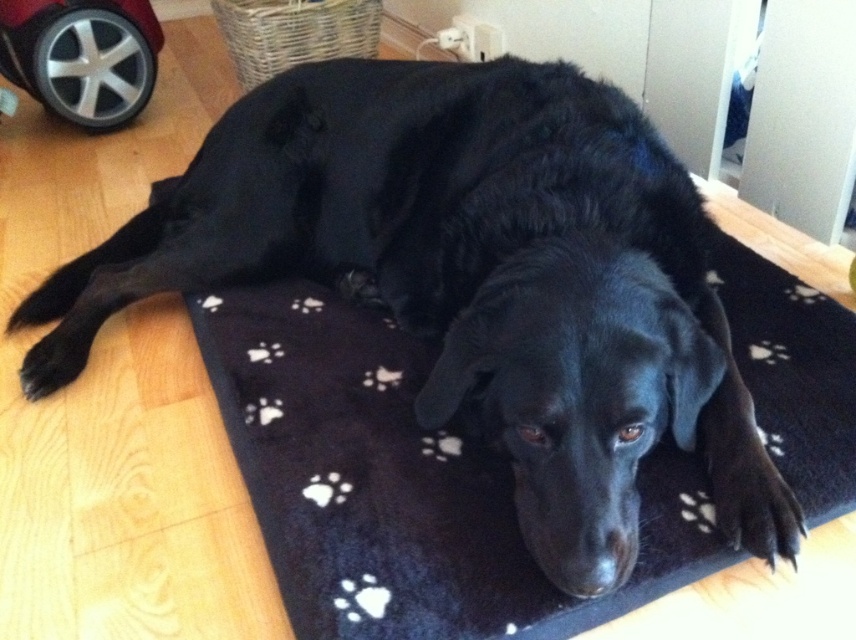
Looking at this image, can you confirm if black fuzzy paw at lower right is positioned to the right of black fur paw at lower left?

Yes, black fuzzy paw at lower right is to the right of black fur paw at lower left.

Who is lower down, black fuzzy paw at lower right or black fur paw at lower left?

Positioned lower is black fuzzy paw at lower right.

Image resolution: width=856 pixels, height=640 pixels. Find the location of `black fuzzy paw at lower right`. black fuzzy paw at lower right is located at coordinates (753, 500).

Can you confirm if black fleece dog bed at center is smaller than black fur paw at lower left?

No, black fleece dog bed at center is not smaller than black fur paw at lower left.

Does black fleece dog bed at center appear over black fur paw at lower left?

Incorrect, black fleece dog bed at center is not positioned above black fur paw at lower left.

This screenshot has width=856, height=640. What do you see at coordinates (403, 483) in the screenshot? I see `black fleece dog bed at center` at bounding box center [403, 483].

I want to click on black fleece dog bed at center, so click(x=403, y=483).

Which of these two, black fleece dog bed at center or black fuzzy paw at lower right, stands taller?

black fleece dog bed at center is taller.

Is black fleece dog bed at center to the right of black fuzzy paw at lower right from the viewer's perspective?

Incorrect, black fleece dog bed at center is not on the right side of black fuzzy paw at lower right.

Between point (336, 492) and point (789, 518), which one is positioned in front?

Point (789, 518)

The image size is (856, 640). In order to click on black fleece dog bed at center in this screenshot , I will do `click(403, 483)`.